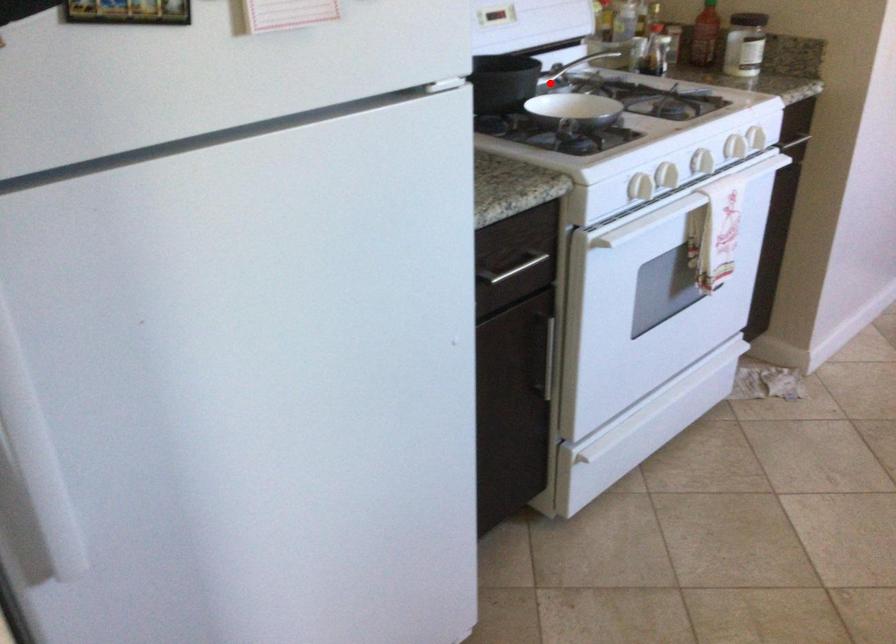
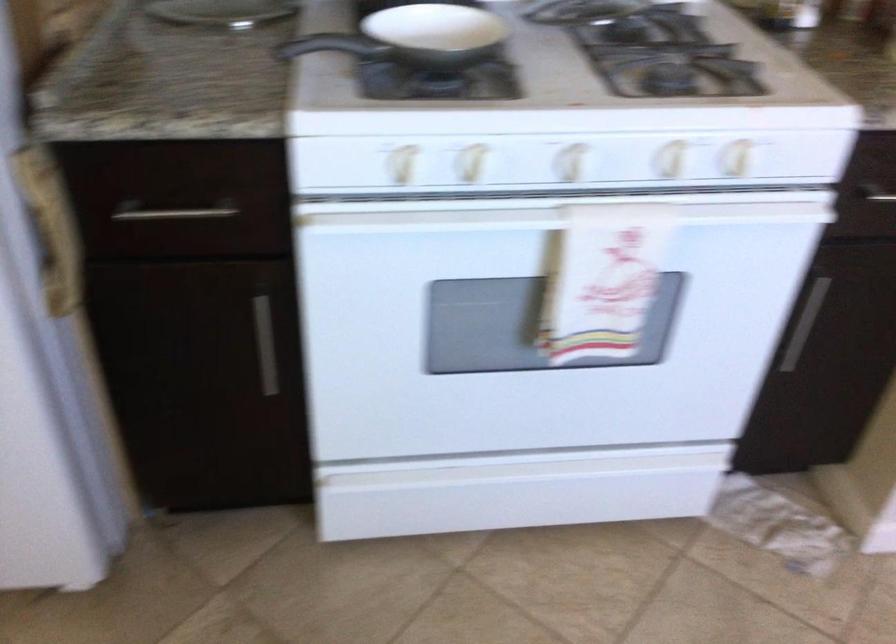
Find the pixel in the second image that matches the highlighted location in the first image.

(436, 33)